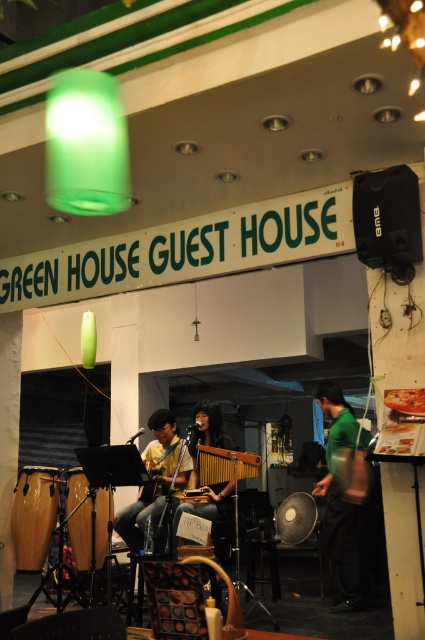
Question: Which of the following is the closest to the observer?

Choices:
 (A) (314, 493)
 (B) (204, 477)
 (C) (209, 444)
 (D) (158, 422)

Answer: (B)

Question: Among these objects, which one is nearest to the camera?

Choices:
 (A) green matte shirt at center
 (B) wooden xylophone at center
 (C) smooth brown guitar at center

Answer: (C)

Question: Can you confirm if green matte shirt at center is smaller than smooth brown guitar at center?

Choices:
 (A) no
 (B) yes

Answer: (A)

Question: In this image, where is green matte shirt at center located relative to yellow fabric guitar at center?

Choices:
 (A) left
 (B) right

Answer: (B)

Question: Considering the relative positions of green matte shirt at center and yellow fabric guitar at center in the image provided, where is green matte shirt at center located with respect to yellow fabric guitar at center?

Choices:
 (A) right
 (B) left

Answer: (A)

Question: Which object is closer to the camera taking this photo?

Choices:
 (A) wooden xylophone at center
 (B) yellow fabric guitar at center

Answer: (A)